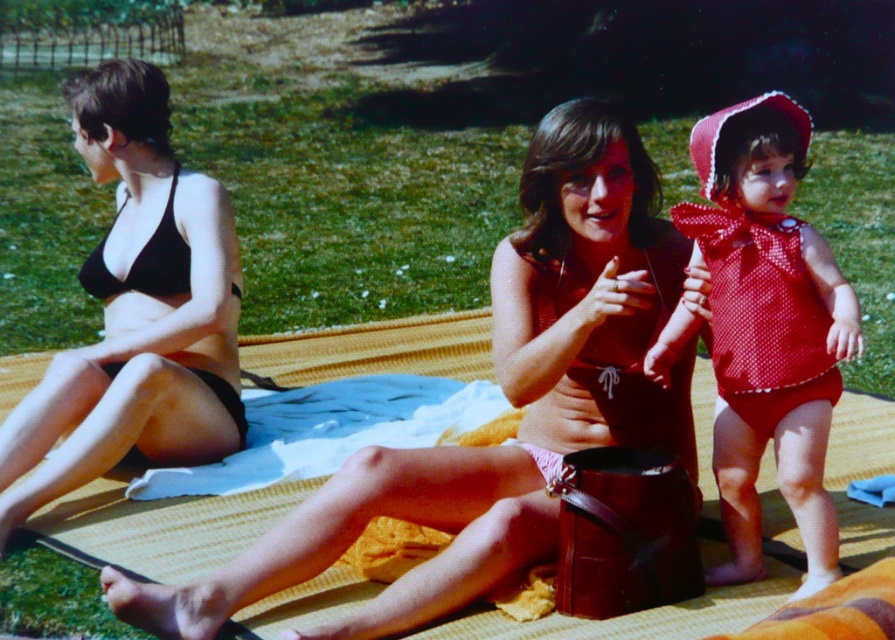
Question: Is pink matte swimsuit at center positioned before polka dot fabric swimsuit at center?

Choices:
 (A) yes
 (B) no

Answer: (A)

Question: Can you confirm if black matte bikini top at upper left is positioned below matte black bikini top at upper left?

Choices:
 (A) no
 (B) yes

Answer: (B)

Question: Considering the real-world distances, which object is farthest from the polka dot fabric swimsuit at center?

Choices:
 (A) matte red swimsuit at center
 (B) matte black bikini top at upper left
 (C) black matte bikini top at upper left

Answer: (B)

Question: Is pink matte swimsuit at center wider than matte black bikini top at upper left?

Choices:
 (A) yes
 (B) no

Answer: (A)

Question: Which of the following is the closest to the observer?

Choices:
 (A) smooth skin face at center
 (B) polka dot fabric swimsuit at center
 (C) pink matte swimsuit at center
 (D) matte red swimsuit at center

Answer: (C)

Question: Estimate the real-world distances between objects in this image. Which object is closer to the polka dot fabric swimsuit at center?

Choices:
 (A) black matte bikini top at upper left
 (B) matte red swimsuit at center

Answer: (B)